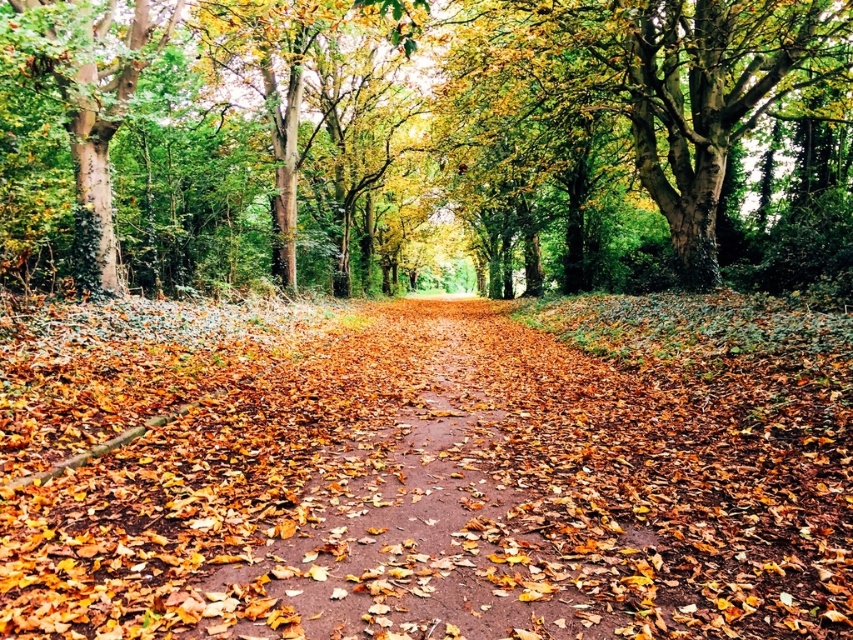
Question: Does smooth bark tree at center have a lesser width compared to green rough bark tree at left?

Choices:
 (A) yes
 (B) no

Answer: (B)

Question: Which point appears farthest from the camera in this image?

Choices:
 (A) (103, 161)
 (B) (564, 372)
 (C) (697, 236)

Answer: (C)

Question: Can you confirm if brown dirt path at center is smaller than green rough bark tree at left?

Choices:
 (A) yes
 (B) no

Answer: (A)

Question: Is brown dirt path at center smaller than green rough bark tree at left?

Choices:
 (A) yes
 (B) no

Answer: (A)

Question: Which object is positioned farthest from the brown dirt path at center?

Choices:
 (A) green rough bark tree at left
 (B) smooth bark tree at center

Answer: (B)

Question: Which object appears farthest from the camera in this image?

Choices:
 (A) green rough bark tree at left
 (B) brown dirt path at center
 (C) smooth bark tree at center

Answer: (A)